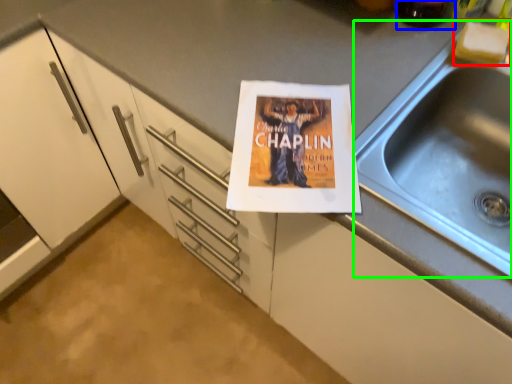
Question: Which object is the closest to the food (highlighted by a red box)? Choose among these: beverage (highlighted by a blue box) or sink (highlighted by a green box).

Choices:
 (A) beverage
 (B) sink

Answer: (A)